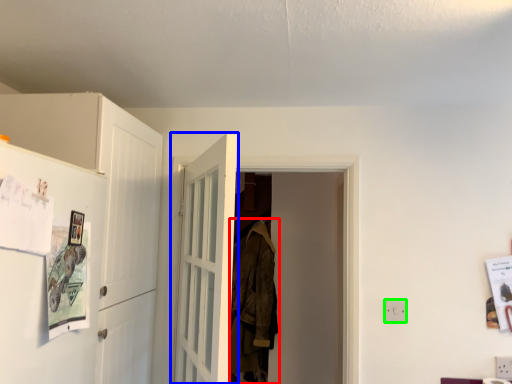
Question: Considering the real-world distances, which object is closest to laundry (highlighted by a red box)? door (highlighted by a blue box) or electric outlet (highlighted by a green box).

Choices:
 (A) door
 (B) electric outlet

Answer: (A)